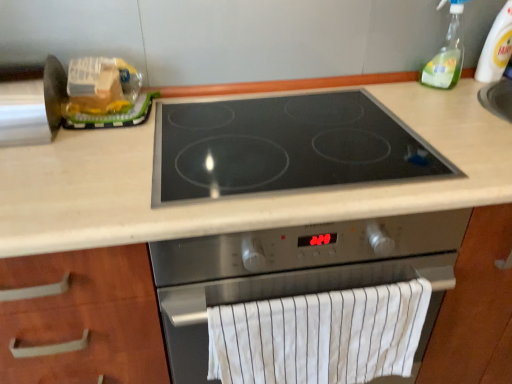
Question: Looking at the image, does black glass cooktop at center seem bigger or smaller compared to translucent plastic bag at upper left?

Choices:
 (A) small
 (B) big

Answer: (B)

Question: Is black glass cooktop at center spatially inside translucent plastic bag at upper left, or outside of it?

Choices:
 (A) inside
 (B) outside

Answer: (B)

Question: Estimate the real-world distances between objects in this image. Which object is farther from the translucent plastic bag at upper left?

Choices:
 (A) white striped towel at lower center
 (B) clear plastic bottle at upper right
 (C) stainless steel cooktop at center
 (D) black glass cooktop at center
 (E) clear plastic bottle at upper right

Answer: (E)

Question: Based on their relative distances, which object is farther from the clear plastic bottle at upper right?

Choices:
 (A) translucent plastic bag at upper left
 (B) stainless steel cooktop at center
 (C) clear plastic bottle at upper right
 (D) black glass cooktop at center
 (E) white striped towel at lower center

Answer: (A)